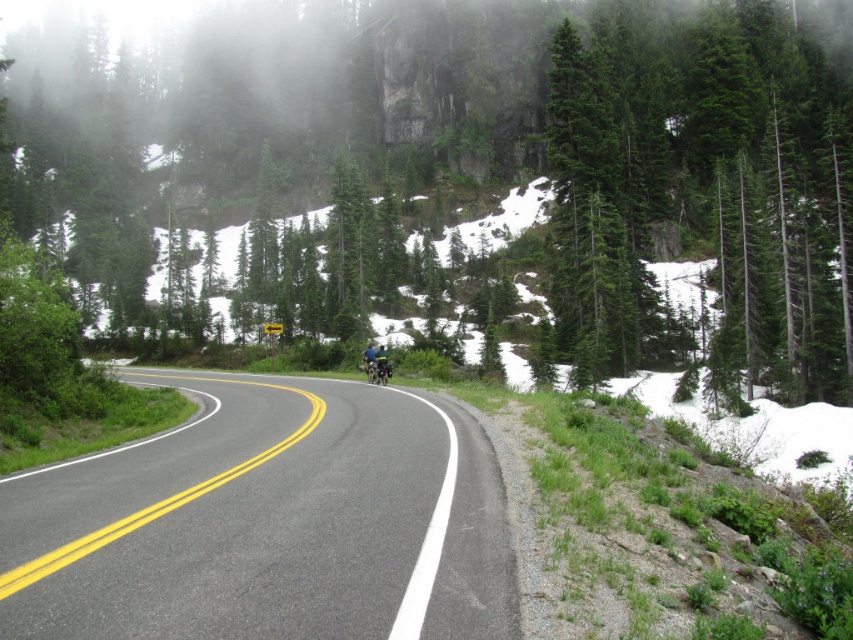
Is green textured tree at center behind black asphalt road at center?

Yes, it is.

Consider the image. Which is more to the left, green textured tree at center or black asphalt road at center?

green textured tree at center is more to the left.

Who is more forward, (73, 225) or (410, 536)?

Point (410, 536) is more forward.

Identify the location of green textured tree at center. Image resolution: width=853 pixels, height=640 pixels. (456, 176).